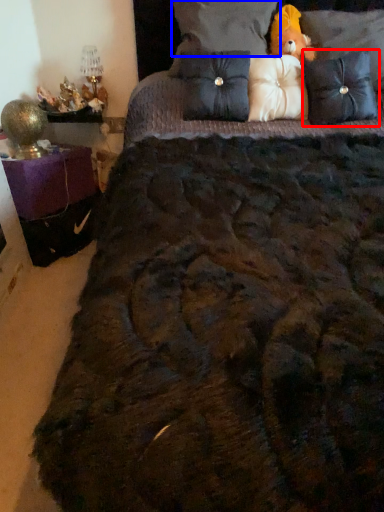
Question: Which of the following is the farthest to the observer, pillow (highlighted by a red box) or pillow (highlighted by a blue box)?

Choices:
 (A) pillow
 (B) pillow

Answer: (B)